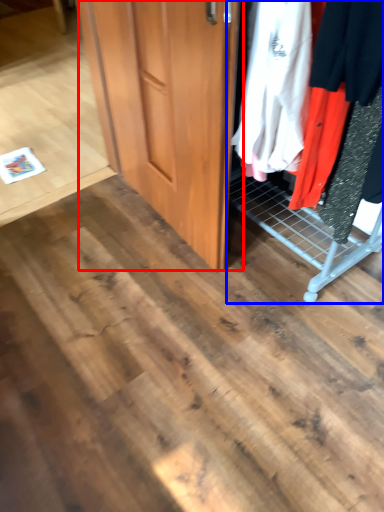
Question: Which object is further to the camera taking this photo, door (highlighted by a red box) or closet (highlighted by a blue box)?

Choices:
 (A) door
 (B) closet

Answer: (A)